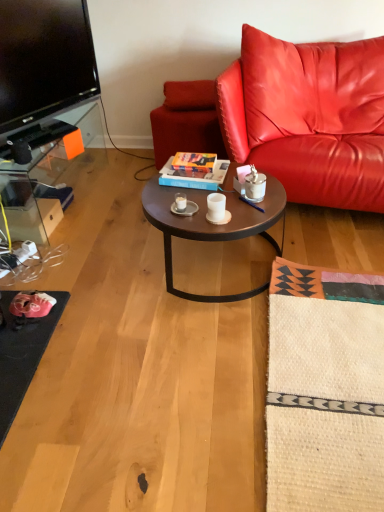
The image size is (384, 512). Identify the location of vacant space situated on the left part of metallic pen at center. (229, 207).